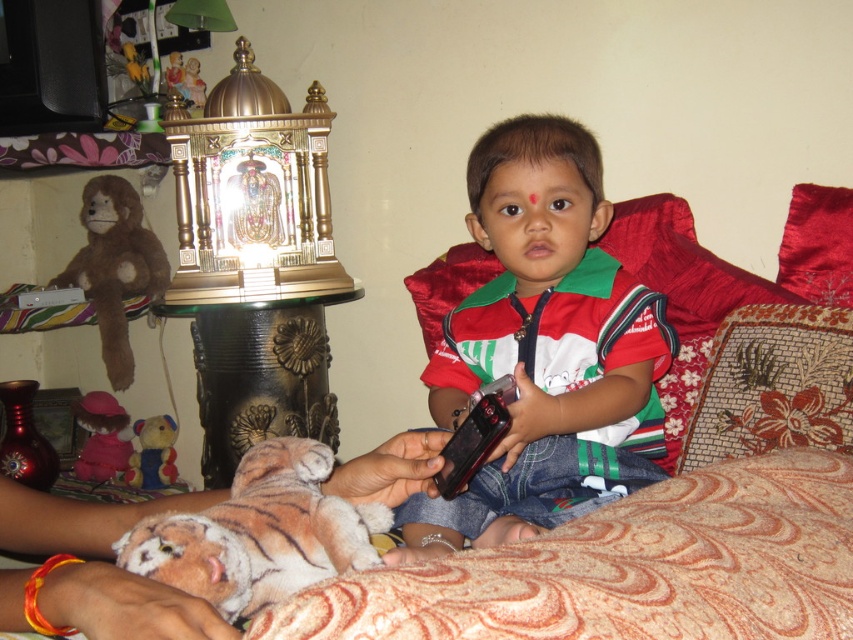
Is point (262, 499) closer to viewer compared to point (157, 460)?

Yes, it is.

Can you confirm if soft plush tiger at lower left is bigger than velvety brown teddy bear at lower left?

Yes.

Is point (282, 449) in front of point (164, 476)?

Yes.

Where is `soft plush tiger at lower left`? soft plush tiger at lower left is located at coordinates (259, 532).

Can you confirm if soft plush tiger at lower left is positioned to the right of brown plush monkey at left?

Correct, you'll find soft plush tiger at lower left to the right of brown plush monkey at left.

Which is behind, point (300, 493) or point (64, 284)?

Positioned behind is point (64, 284).

Is point (318, 488) behind point (90, 257)?

No, it is not.

I want to click on soft plush tiger at lower left, so click(x=259, y=532).

Is brown plush monkey at left shorter than velvet plush toy at lower left?

Incorrect, brown plush monkey at left's height does not fall short of velvet plush toy at lower left's.

Who is taller, brown plush monkey at left or velvet plush toy at lower left?

With more height is brown plush monkey at left.

This screenshot has width=853, height=640. Find the location of `brown plush monkey at left`. brown plush monkey at left is located at coordinates (114, 268).

Identify the location of brown plush monkey at left. This screenshot has width=853, height=640. (114, 268).